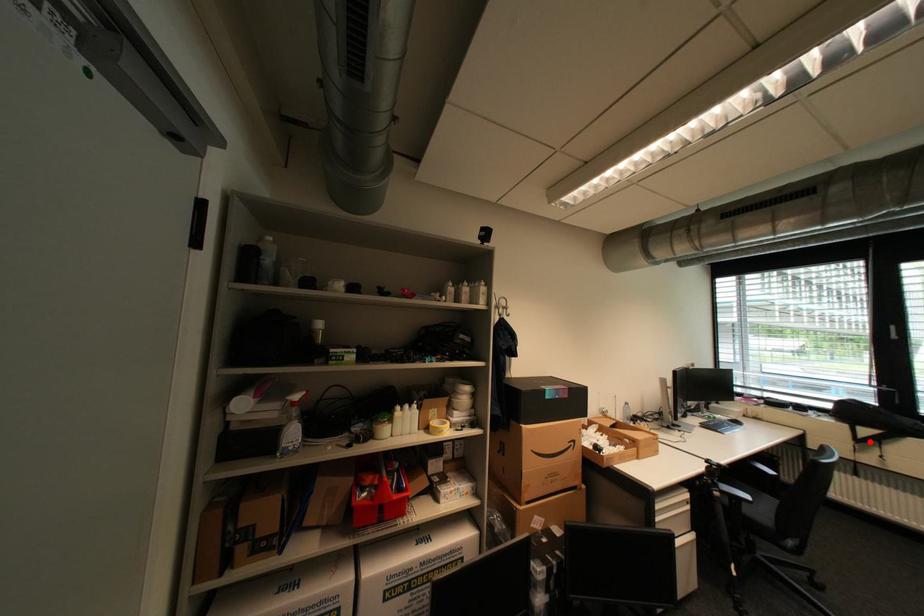
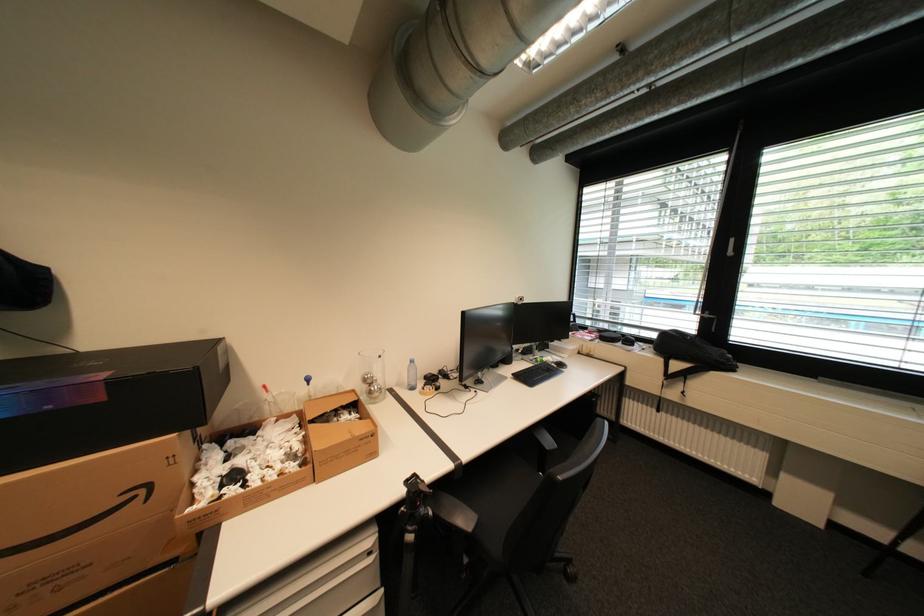
Locate, in the second image, the point that corresponds to the highlighted location in the first image.

(678, 377)